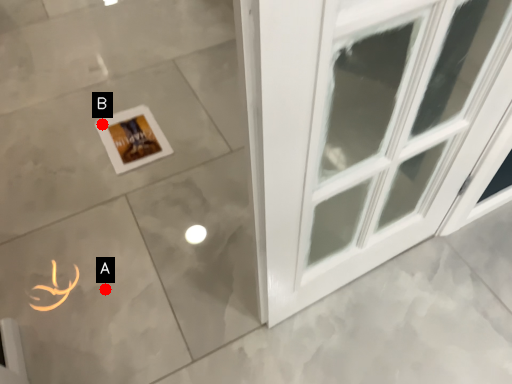
Question: Two points are circled on the image, labeled by A and B beside each circle. Which of the following is the farthest from the observer?

Choices:
 (A) A is further
 (B) B is further

Answer: (B)